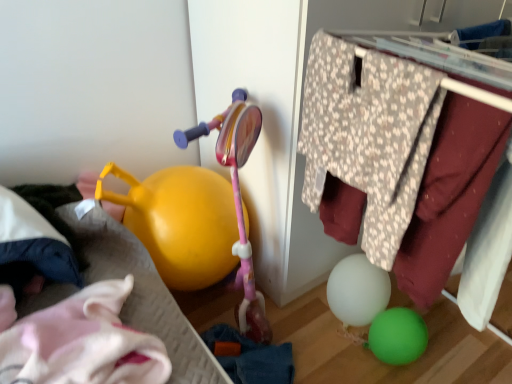
Question: Does white soft pillow at left turn towards yellow plastic watering can at left?

Choices:
 (A) yes
 (B) no

Answer: (A)

Question: Does white soft pillow at left have a greater width compared to yellow plastic watering can at left?

Choices:
 (A) yes
 (B) no

Answer: (B)

Question: Would you consider white soft pillow at left to be distant from yellow plastic watering can at left?

Choices:
 (A) yes
 (B) no

Answer: (B)

Question: Is yellow plastic watering can at left at the back of white soft pillow at left?

Choices:
 (A) yes
 (B) no

Answer: (B)

Question: Is white soft pillow at left completely or partially outside of yellow plastic watering can at left?

Choices:
 (A) yes
 (B) no

Answer: (B)

Question: From a real-world perspective, is white soft pillow at left physically located above or below yellow plastic watering can at left?

Choices:
 (A) above
 (B) below

Answer: (A)

Question: Is point (4, 225) positioned closer to the camera than point (48, 377)?

Choices:
 (A) closer
 (B) farther

Answer: (B)

Question: In terms of width, does white soft pillow at left look wider or thinner when compared to yellow plastic watering can at left?

Choices:
 (A) wide
 (B) thin

Answer: (B)

Question: Considering their positions, is white soft pillow at left located in front of or behind yellow plastic watering can at left?

Choices:
 (A) behind
 (B) front

Answer: (A)

Question: In terms of size, does floral fabric clothes hanger at upper right appear bigger or smaller than white soft pillow at left?

Choices:
 (A) big
 (B) small

Answer: (A)

Question: From the image's perspective, is floral fabric clothes hanger at upper right positioned above or below white soft pillow at left?

Choices:
 (A) above
 (B) below

Answer: (A)

Question: Is point tap(400, 64) positioned closer to the camera than point tap(66, 249)?

Choices:
 (A) closer
 (B) farther

Answer: (A)

Question: From a real-world perspective, relative to white soft pillow at left, is floral fabric clothes hanger at upper right vertically above or below?

Choices:
 (A) below
 (B) above

Answer: (B)

Question: From a real-world perspective, is floral fabric clothes hanger at upper right above or below yellow plastic watering can at left?

Choices:
 (A) above
 (B) below

Answer: (A)

Question: Considering the positions of floral fabric clothes hanger at upper right and yellow plastic watering can at left in the image, is floral fabric clothes hanger at upper right wider or thinner than yellow plastic watering can at left?

Choices:
 (A) thin
 (B) wide

Answer: (A)